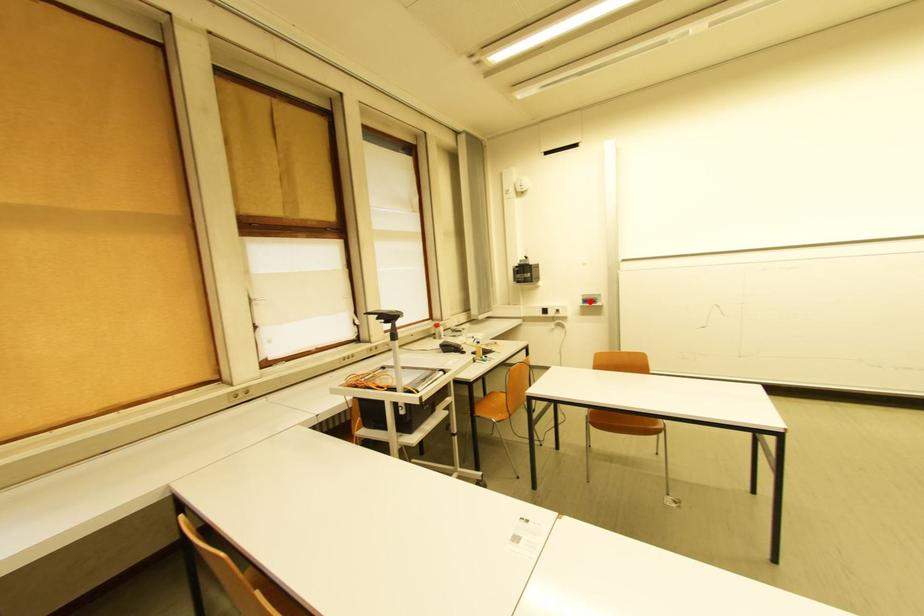
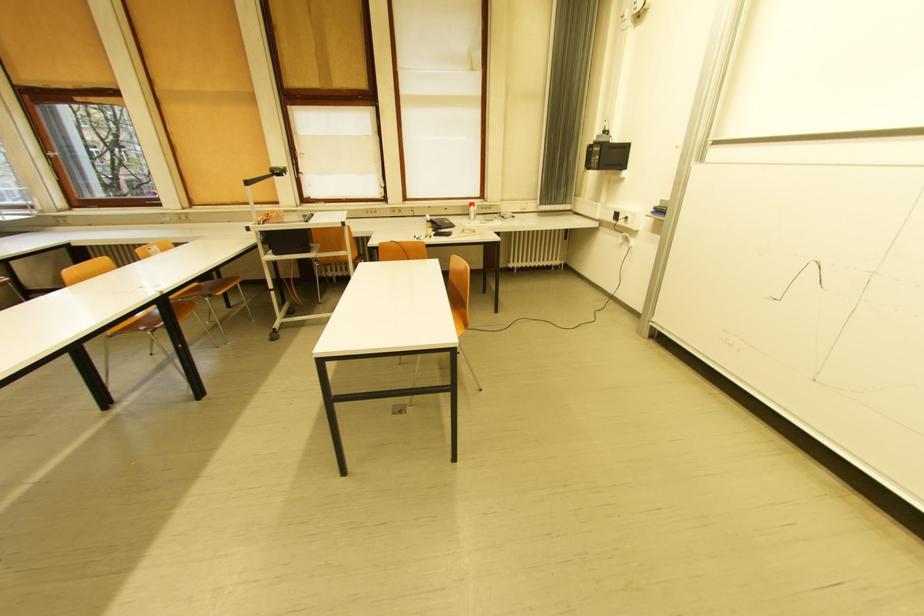
Where in the second image is the point corresponding to the highlighted location from the first image?

(662, 209)